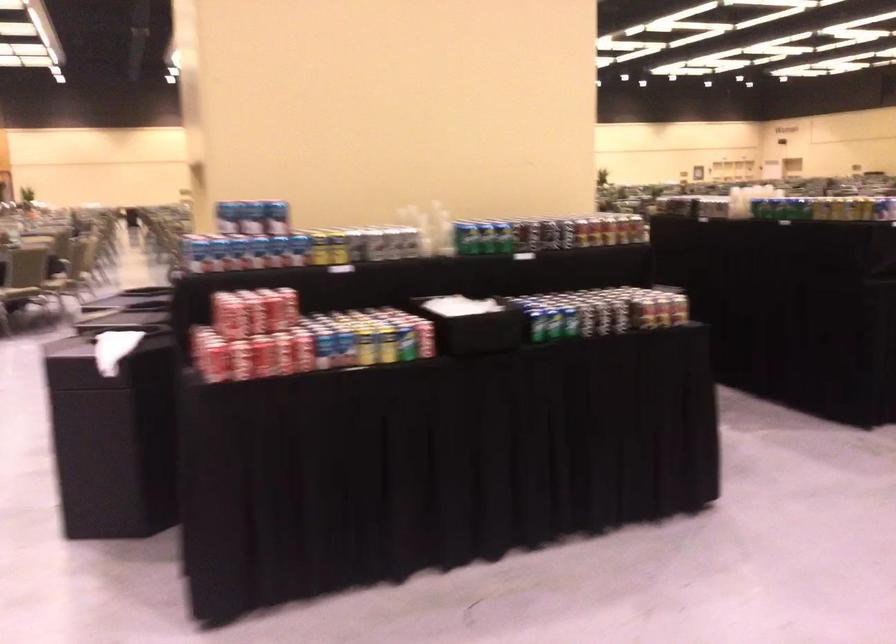
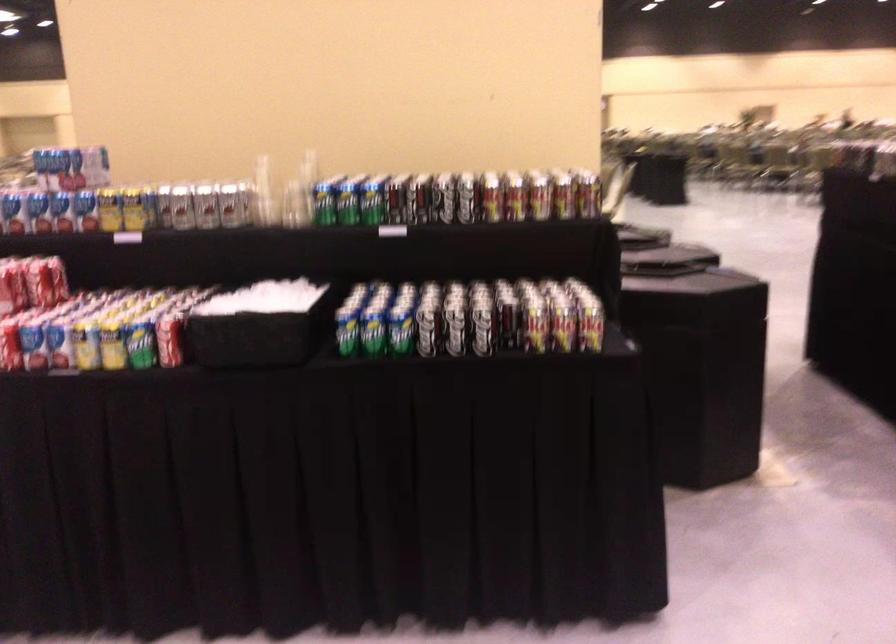
Find the pixel in the second image that matches (553,325) in the first image.

(374, 335)